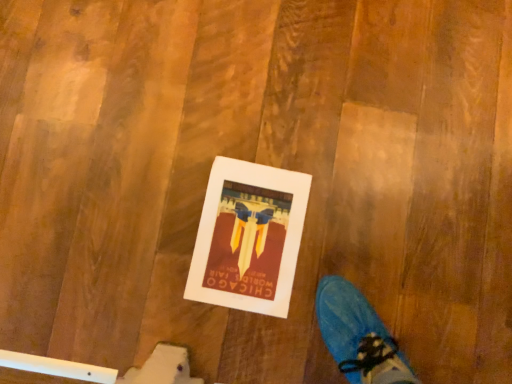
At what (x,y) coordinates should I click in order to perform the action: click on free location in front of matte paper postcard at center. Please return your answer as a coordinate pair (x, y). This screenshot has width=512, height=384. Looking at the image, I should click on (197, 332).